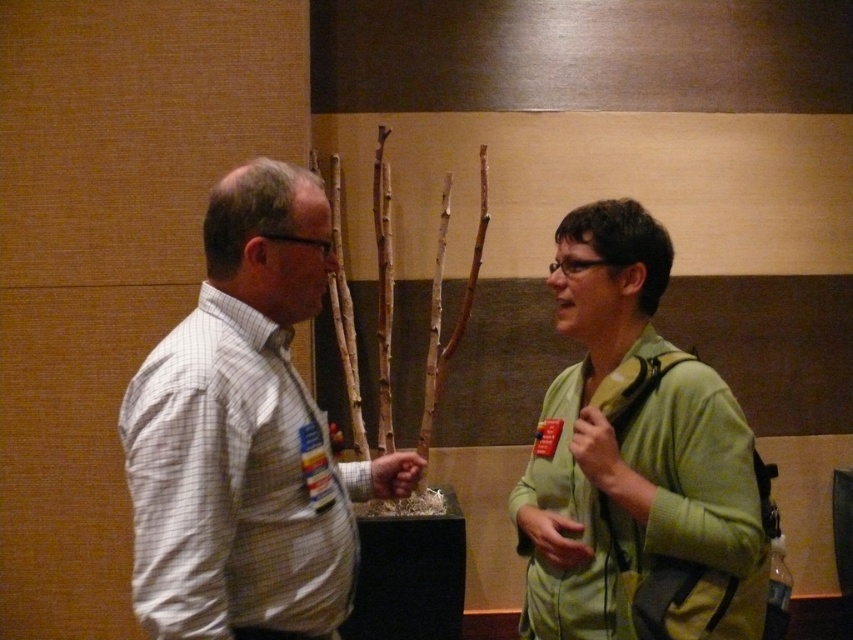
You are standing in a room where two people are talking. You see a green matte jacket at center and a green matte jacket at right. Which one is closer to the left side of the room?

The green matte jacket at center is closer to the left side of the room because it is positioned to the left of the green matte jacket at right.

You are standing at point (131,403) and want to take a photo of the two people in the scene. The camera you have can capture subjects up to 1.5 meters away. Will you be able to take a clear photo of them?

The distance between point (131,403) and the camera is 1.26 meters, which is within the camera maximum range of 1.5 meters. So yes, you can take a clear photo of them.

Based on the photo, you are standing in front of the two people having a conversation. There are two points marked on the image at coordinates point (631, 321) and point (239, 230). Which point is closer to your eyes?

Point (239, 230) is closer to your eyes because it is nearer to the camera compared to point (631, 321), which is further away.